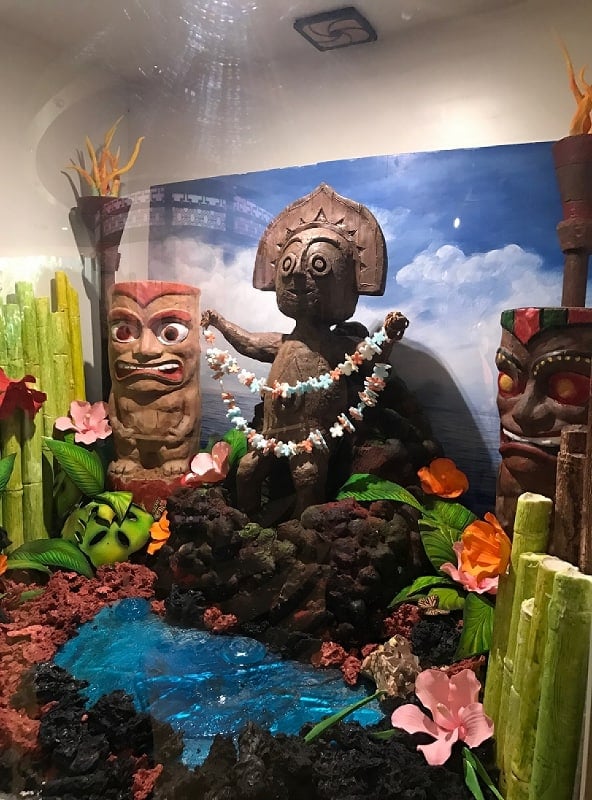
In order to click on painting of sky in this screenshot , I will do `click(424, 266)`.